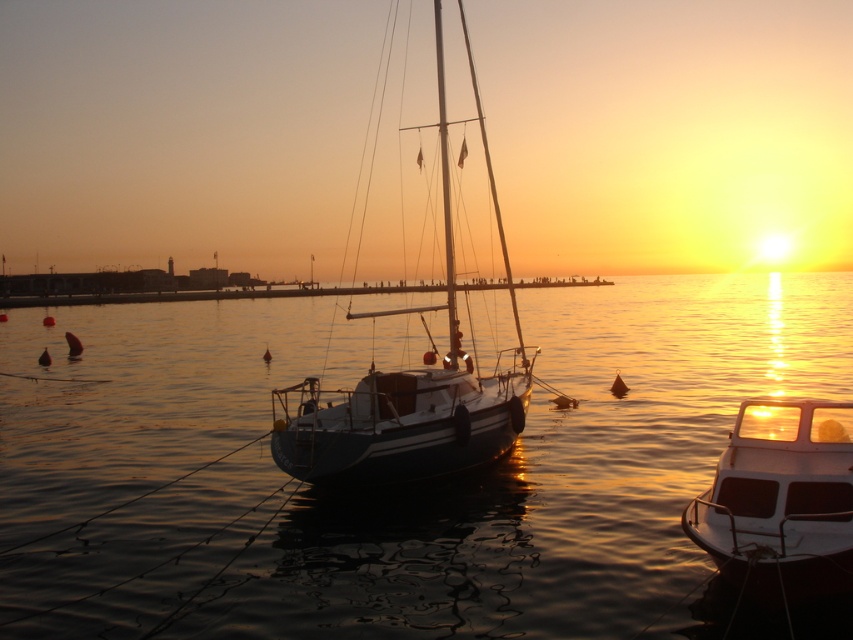
Question: Which point is closer to the camera taking this photo?

Choices:
 (A) (88, 532)
 (B) (757, 566)
 (C) (358, 420)

Answer: (B)

Question: Which point is farther to the camera?

Choices:
 (A) white glossy boat at lower right
 (B) white glossy sailboat at center

Answer: (B)

Question: Which object appears closest to the camera in this image?

Choices:
 (A) white glossy boat at lower right
 (B) glossy water at center

Answer: (A)

Question: Does glossy water at center lie in front of white glossy boat at lower right?

Choices:
 (A) yes
 (B) no

Answer: (B)

Question: Is glossy water at center above white glossy sailboat at center?

Choices:
 (A) yes
 (B) no

Answer: (B)

Question: Is white glossy sailboat at center to the right of white glossy boat at lower right from the viewer's perspective?

Choices:
 (A) no
 (B) yes

Answer: (A)